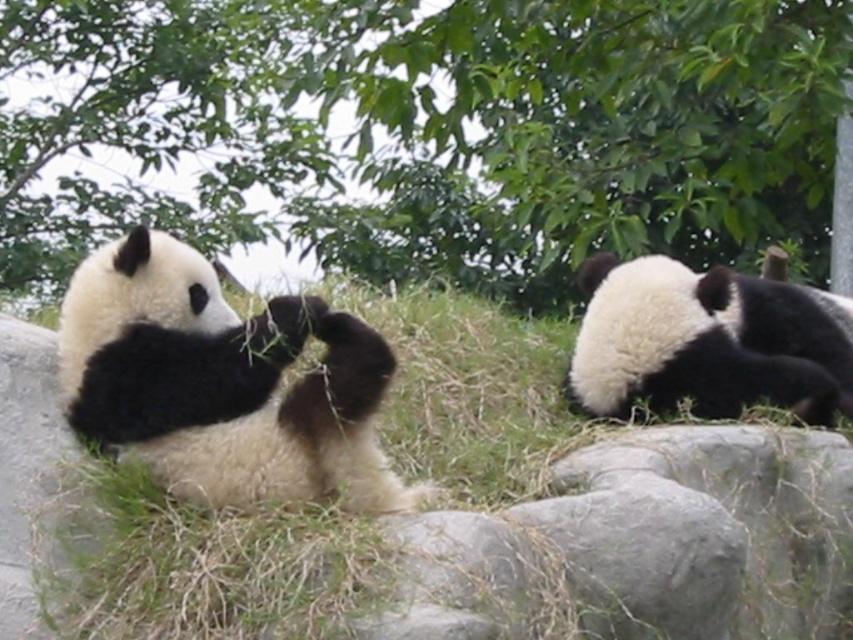
Does point (461, 260) come behind point (842, 531)?

Yes, it is behind point (842, 531).

This screenshot has width=853, height=640. Identify the location of green leafy tree at upper center. [x=426, y=132].

Between green grass at center and black fur panda at upper right, which one appears on the right side from the viewer's perspective?

Positioned to the right is black fur panda at upper right.

Is point (306, 582) behind point (668, 305)?

No.

Measure the distance between green grass at center and camera.

green grass at center is 5.36 feet away from camera.

At what (x,y) coordinates should I click in order to perform the action: click on green grass at center. Please return your answer as a coordinate pair (x, y). Looking at the image, I should click on (445, 513).

In the scene shown: Is green leafy tree at upper center to the right of black fur panda at upper right from the viewer's perspective?

No, green leafy tree at upper center is not to the right of black fur panda at upper right.

Can you confirm if green leafy tree at upper center is bigger than black fur panda at upper right?

Yes, green leafy tree at upper center is bigger than black fur panda at upper right.

Does point (628, 44) lie in front of point (636, 310)?

No, (628, 44) is further to viewer.

Locate an element on the screen. green leafy tree at upper center is located at coordinates (426, 132).